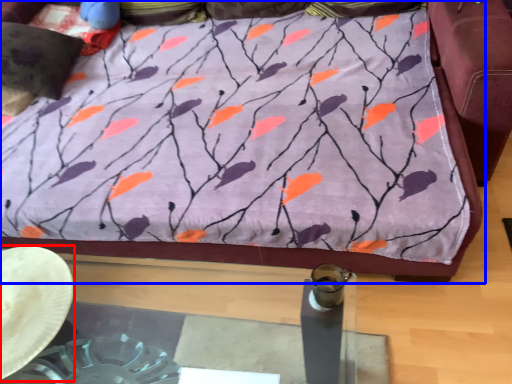
Question: Among these objects, which one is farthest to the camera, cowboy hat (highlighted by a red box) or furniture (highlighted by a blue box)?

Choices:
 (A) cowboy hat
 (B) furniture

Answer: (B)